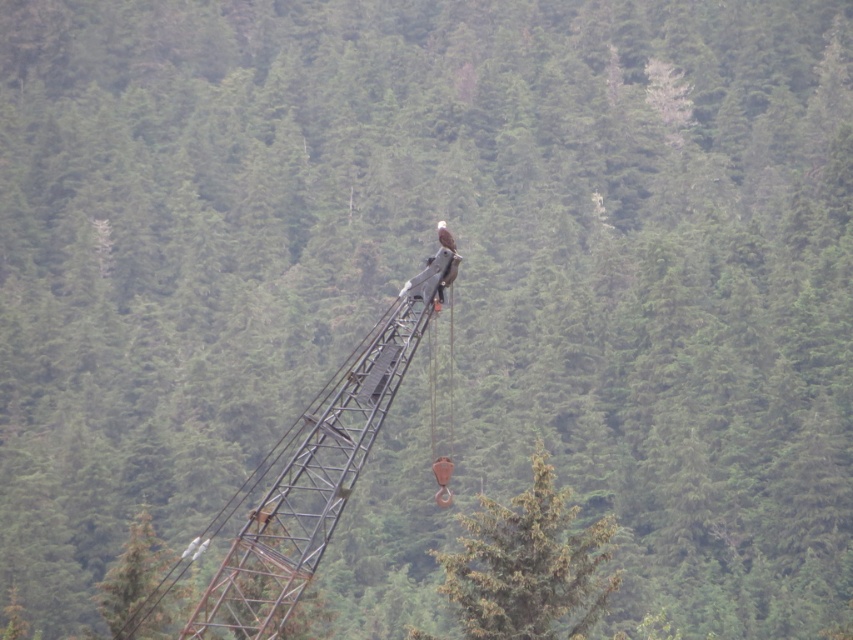
You are standing in front of the scene. Which object is positioned to the right side when looking at the rusty metal crane at center and the green matte tree at center?

The green matte tree at center is positioned to the right of the rusty metal crane at center.

You are a construction worker who needs to transport a 3m wide equipment through the area between the rusty metal crane at center and the green matte tree at center. Based on the scene description, can the equipment pass through the space between them?

The rusty metal crane at center is wider than the green matte tree at center. However, the exact distance between them isn not provided in the scene description. Without knowing the space between them, it is impossible to determine if the 3m wide equipment can pass through.